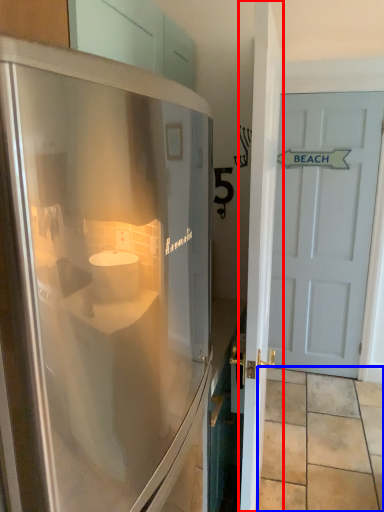
Question: Among these objects, which one is farthest to the camera, door (highlighted by a red box) or tile (highlighted by a blue box)?

Choices:
 (A) door
 (B) tile

Answer: (B)